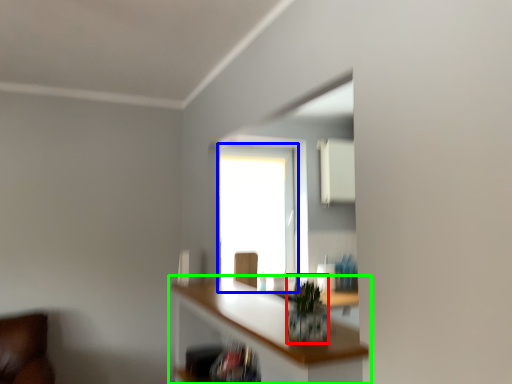
Question: Which object is the closest to the plant (highlighted by a red box)? Choose among these: window (highlighted by a blue box) or shelf (highlighted by a green box).

Choices:
 (A) window
 (B) shelf

Answer: (B)